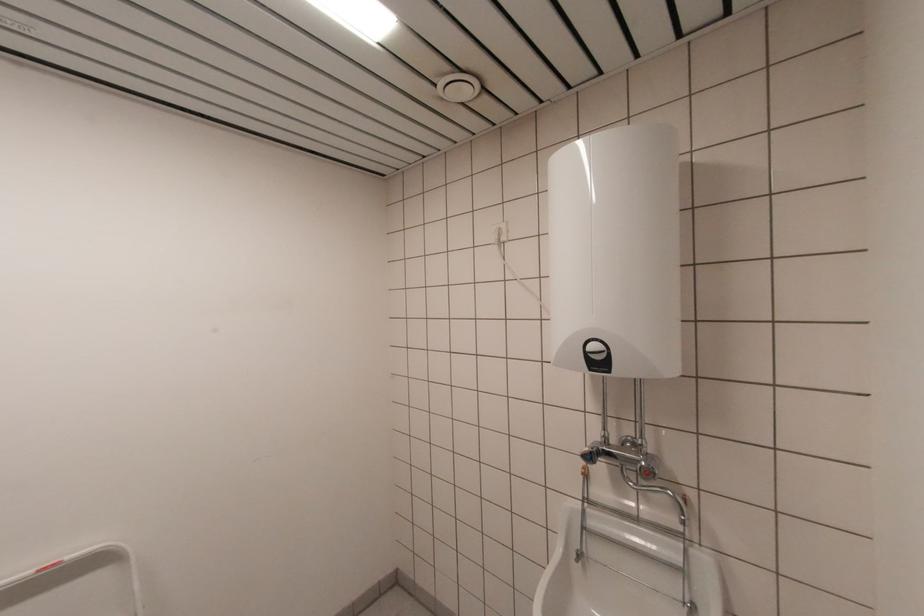
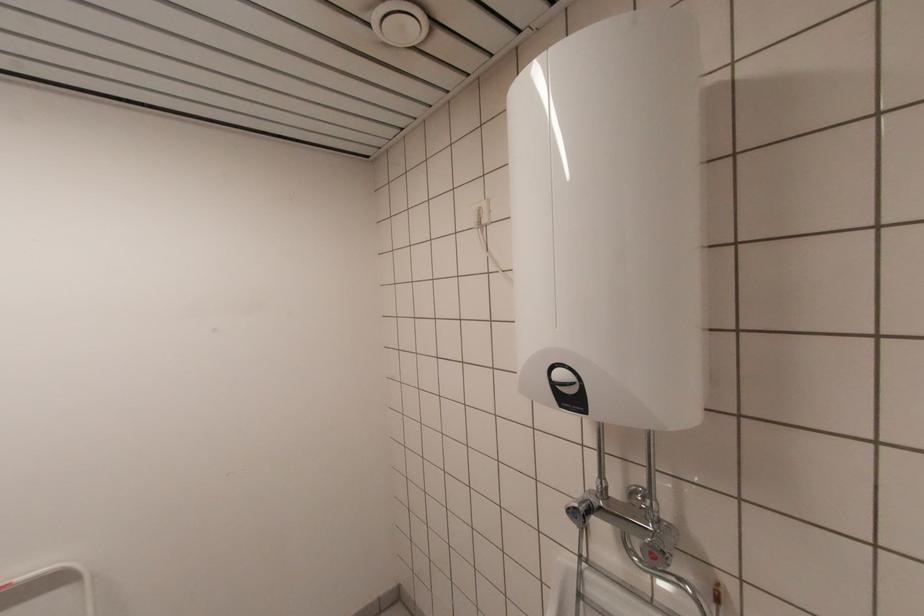
In the scene shown: What movement of the cameraman would produce the second image?

The cameraman moved toward right, forward.